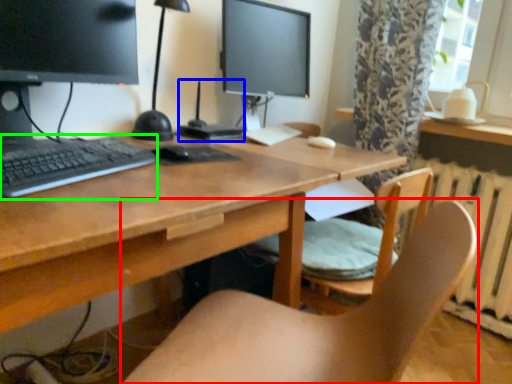
Question: Considering the real-world distances, which object is farthest from chair (highlighted by a red box)? computer (highlighted by a blue box) or computer keyboard (highlighted by a green box)?

Choices:
 (A) computer
 (B) computer keyboard

Answer: (A)